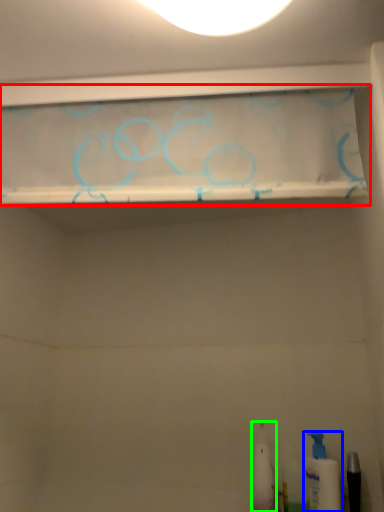
Question: Which object is positioned closest to shelf (highlighted by a red box)? Select from toiletry (highlighted by a blue box) and toiletry (highlighted by a green box).

Choices:
 (A) toiletry
 (B) toiletry

Answer: (B)